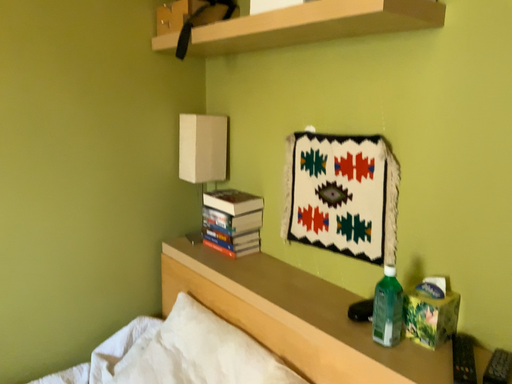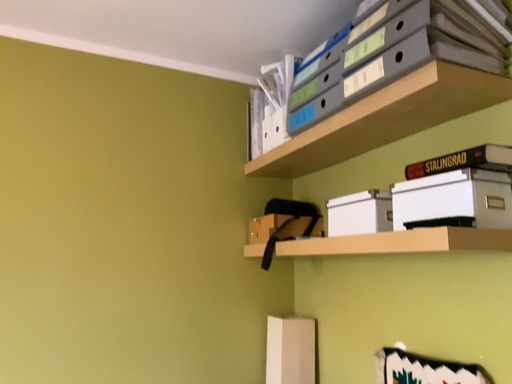
Question: How did the camera likely rotate when shooting the video?

Choices:
 (A) rotated downward
 (B) rotated upward

Answer: (B)